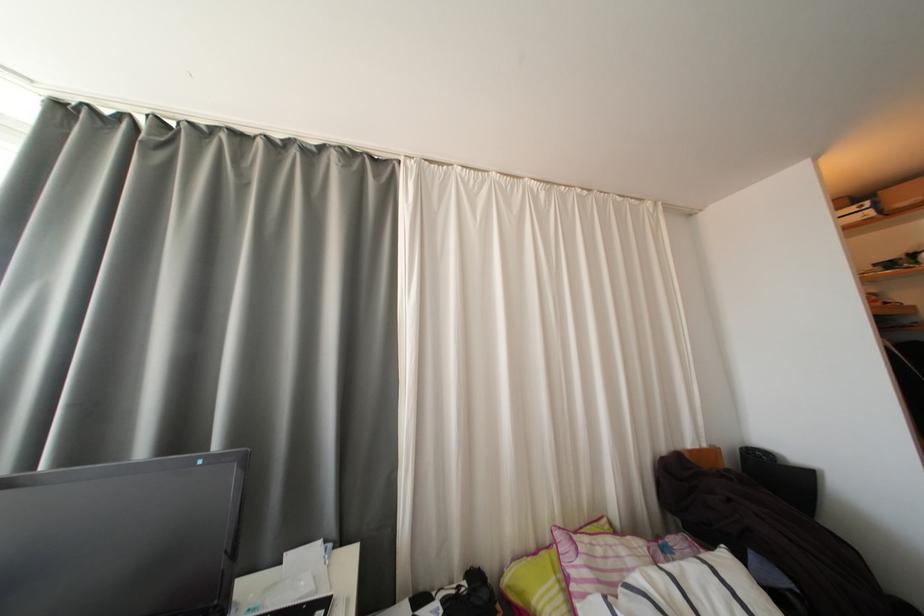
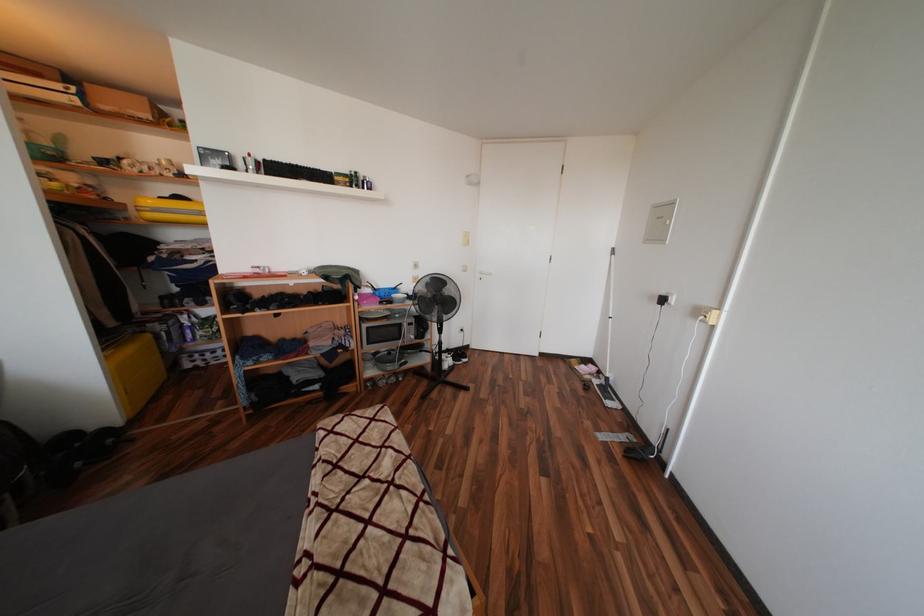
Question: The camera is either moving clockwise (left) or counter-clockwise (right) around the object. The first image is from the beginning of the video and the second image is from the end. Is the camera moving left or right when shooting the video?

Choices:
 (A) Left
 (B) Right

Answer: (A)